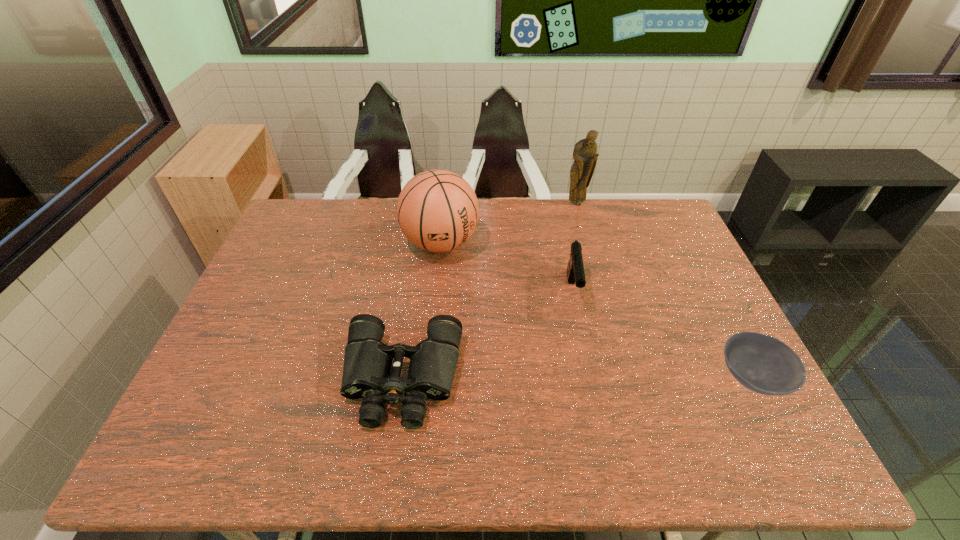
Locate an element on the screen. This screenshot has width=960, height=540. binoculars located at the near edge is located at coordinates 367,366.

Identify the location of bowl that is at the near edge. Image resolution: width=960 pixels, height=540 pixels. (761, 363).

Find the location of a particular element. object located at the right edge is located at coordinates (761, 363).

Locate an element on the screen. The width and height of the screenshot is (960, 540). object at the near right corner is located at coordinates (761, 363).

Identify the location of vacant space at the far edge. (506, 216).

In order to click on free space at the near edge in this screenshot , I will do `click(528, 414)`.

Where is `vacant space at the left edge of the desktop`? This screenshot has width=960, height=540. vacant space at the left edge of the desktop is located at coordinates (243, 377).

Identify the location of vacant space at the right edge. (684, 295).

The image size is (960, 540). I want to click on free space at the far left corner of the desktop, so [x=323, y=239].

Where is `vacant area at the near left corner`? This screenshot has height=540, width=960. vacant area at the near left corner is located at coordinates (198, 411).